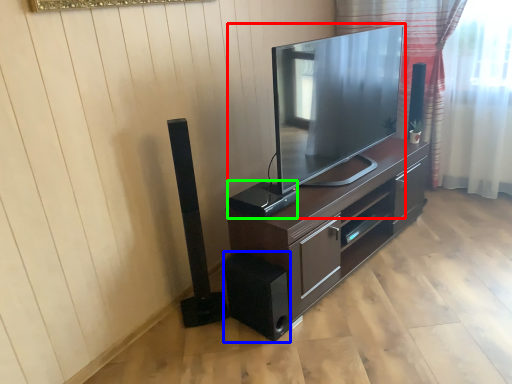
Question: Estimate the real-world distances between objects in this image. Which object is farther from television (highlighted by a red box), speaker (highlighted by a blue box) or speaker (highlighted by a green box)?

Choices:
 (A) speaker
 (B) speaker

Answer: (A)